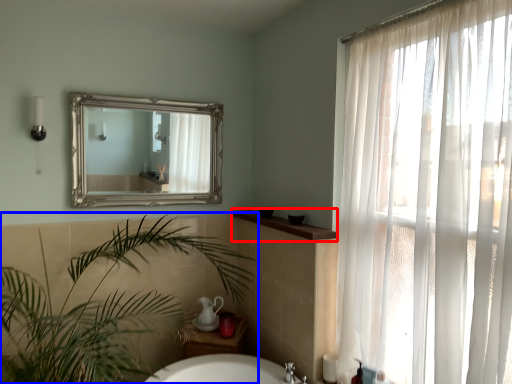
Question: Among these objects, which one is farthest to the camera, counter top (highlighted by a red box) or houseplant (highlighted by a blue box)?

Choices:
 (A) counter top
 (B) houseplant

Answer: (A)